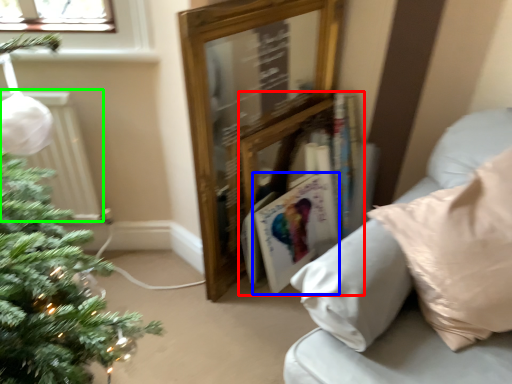
Question: Which is nearer to the book (highlighted by a red box)? magazine (highlighted by a blue box) or radiator (highlighted by a green box).

Choices:
 (A) magazine
 (B) radiator

Answer: (A)